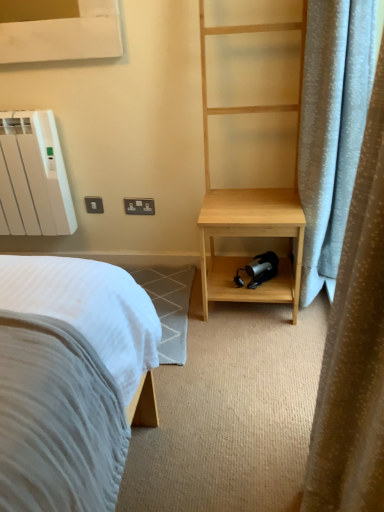
Where is `vacant region to the left of natural wood bookshelf at right`? The width and height of the screenshot is (384, 512). vacant region to the left of natural wood bookshelf at right is located at coordinates (180, 304).